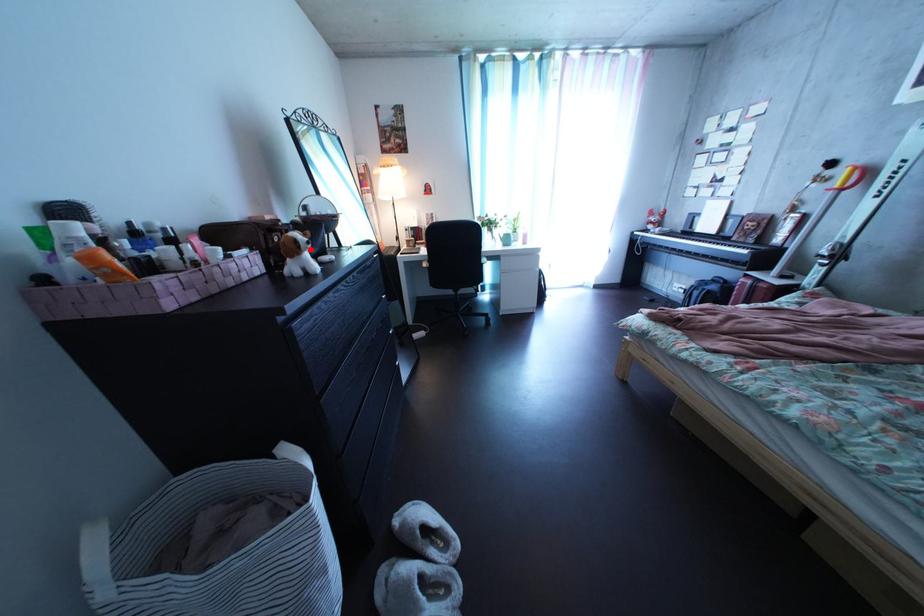
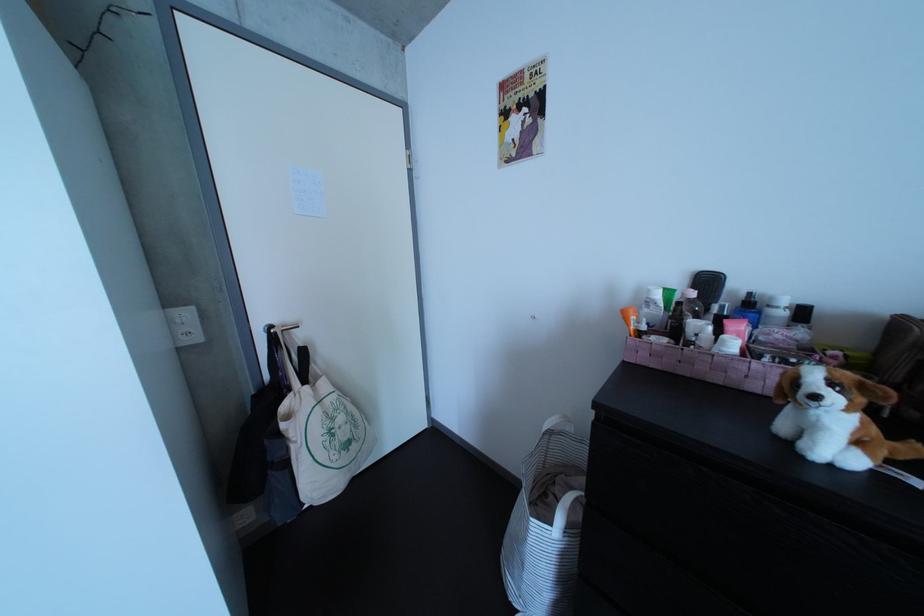
The point at the highlighted location is marked in the first image. Where is the corresponding point in the second image?

(809, 389)